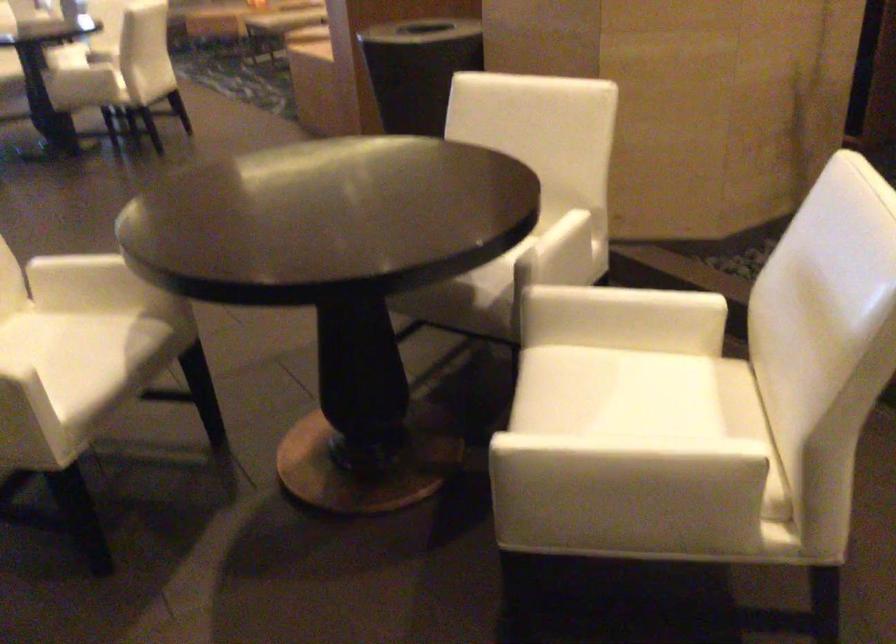
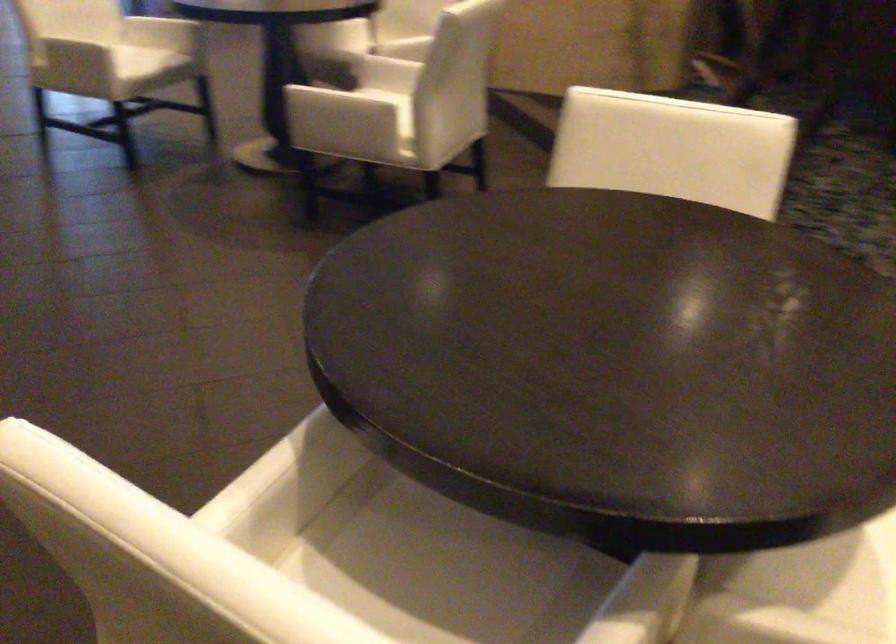
Find the pixel in the second image that matches (x=756, y=502) in the first image.

(371, 109)